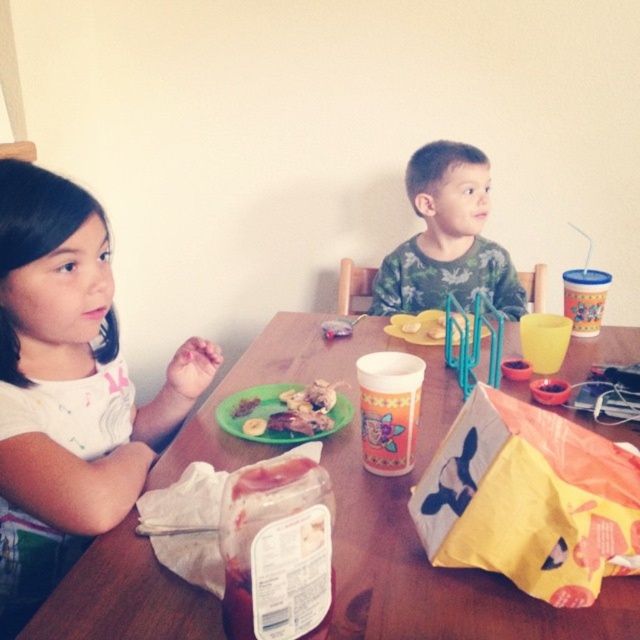
Is camouflage-patterned shirt at center bigger than yellow matte banana at left?

Yes, camouflage-patterned shirt at center is bigger than yellow matte banana at left.

Between point (451, 285) and point (262, 422), which one is positioned behind?

Positioned behind is point (451, 285).

Locate an element on the screen. camouflage-patterned shirt at center is located at coordinates point(448,240).

Is wooden table at center bigger than white matte shirt at left?

Indeed, wooden table at center has a larger size compared to white matte shirt at left.

Between wooden table at center and white matte shirt at left, which one appears on the right side from the viewer's perspective?

wooden table at center

Between point (339, 632) and point (49, 420), which one is positioned behind?

The point (49, 420) is behind.

Where is `wooden table at center`? wooden table at center is located at coordinates (426, 561).

Consider the image. Between smooth plastic plate with food at center and yellow matte banana at left, which one has less height?

With less height is yellow matte banana at left.

You are a GUI agent. You are given a task and a screenshot of the screen. Output one action in this format:
    pyautogui.click(x=<x>, y=<y>)
    Task: Click on the smooth plastic plate with food at center
    The width and height of the screenshot is (640, 640).
    Given the screenshot: What is the action you would take?
    pyautogui.click(x=288, y=410)